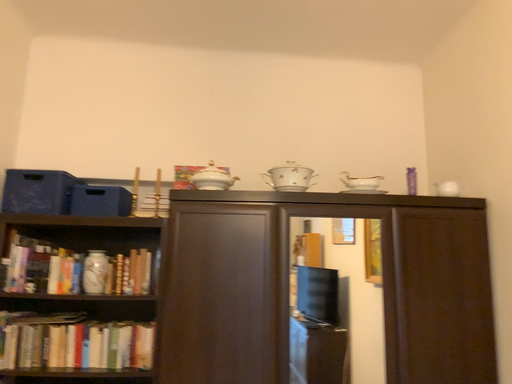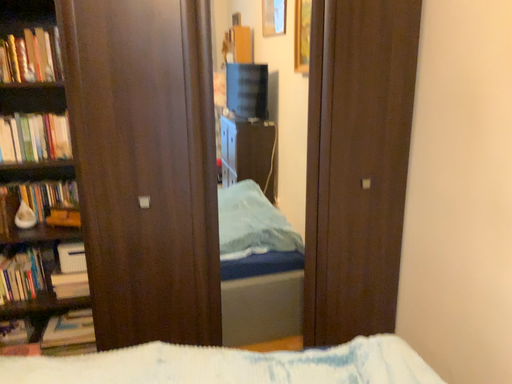
Question: Which way did the camera rotate in the video?

Choices:
 (A) rotated downward
 (B) rotated upward

Answer: (A)